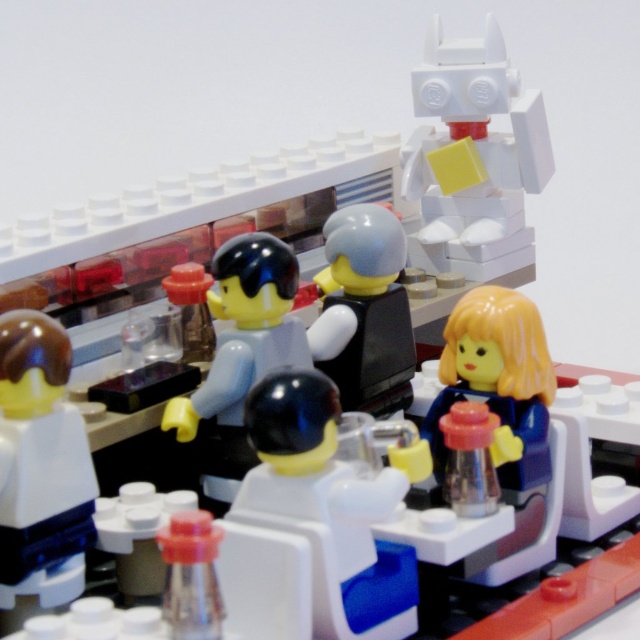
Between point (307, 525) and point (236, 292), which one is positioned in front?

Positioned in front is point (307, 525).

Find the location of a particular element. This screenshot has width=640, height=640. white plastic figure at center is located at coordinates (330, 508).

This screenshot has width=640, height=640. I want to click on white plastic figure at center, so click(x=330, y=508).

In the scene shown: Does smooth white torso at center appear under smooth black vest at center?

Indeed, smooth white torso at center is positioned under smooth black vest at center.

The height and width of the screenshot is (640, 640). Describe the element at coordinates (40, 472) in the screenshot. I see `smooth white torso at center` at that location.

Where is `smooth white torso at center`? The height and width of the screenshot is (640, 640). smooth white torso at center is located at coordinates (40, 472).

Looking at this image, is white plastic figure at center wider than smooth yellow hair at center?

Indeed, white plastic figure at center has a greater width compared to smooth yellow hair at center.

Does white plastic figure at center have a lesser height compared to smooth yellow hair at center?

Yes.

Describe the element at coordinates (330, 508) in the screenshot. This screenshot has height=640, width=640. I see `white plastic figure at center` at that location.

The height and width of the screenshot is (640, 640). What are the coordinates of `white plastic figure at center` in the screenshot? It's located at (330, 508).